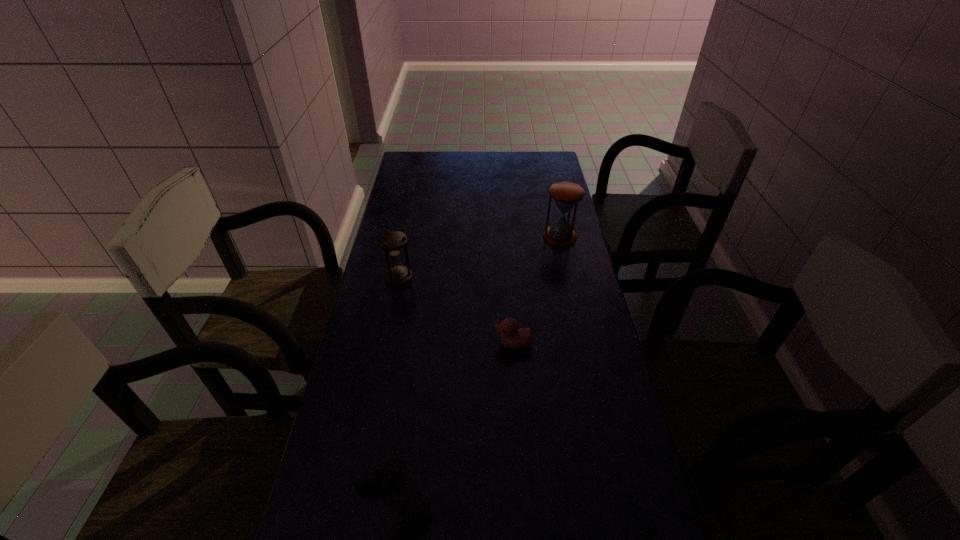
Identify the location of the rightmost object. The height and width of the screenshot is (540, 960). (566, 195).

Locate an element on the screen. The image size is (960, 540). the farthest object is located at coordinates (566, 195).

Locate an element on the screen. the third nearest object is located at coordinates (392, 242).

Locate an element on the screen. The height and width of the screenshot is (540, 960). the nearer hourglass is located at coordinates (392, 242).

You are a GUI agent. You are given a task and a screenshot of the screen. Output one action in this format:
    pyautogui.click(x=<x>, y=<y>)
    Task: Click on the duckling
    Image resolution: width=960 pixels, height=540 pixels.
    Given the screenshot: What is the action you would take?
    tap(512, 337)

The width and height of the screenshot is (960, 540). What are the coordinates of `the second nearest object` in the screenshot? It's located at (512, 337).

Locate an element on the screen. Image resolution: width=960 pixels, height=540 pixels. vacant point located on the front of the right hourglass is located at coordinates 569,278.

What are the coordinates of `free location located on the front of the nearer hourglass` in the screenshot? It's located at (392, 318).

You are a GUI agent. You are given a task and a screenshot of the screen. Output one action in this format:
    pyautogui.click(x=<x>, y=<y>)
    Task: Click on the blank space located on the front-facing side of the third farthest object
    The height and width of the screenshot is (540, 960).
    Given the screenshot: What is the action you would take?
    pyautogui.click(x=396, y=344)

The height and width of the screenshot is (540, 960). Identify the location of free space located 0.050m on the front-facing side of the third farthest object. (476, 344).